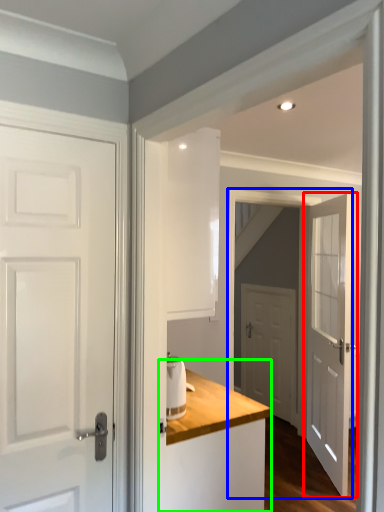
Question: Which object is the closest to the door (highlighted by a red box)? Choose among these: screen door (highlighted by a blue box) or dresser (highlighted by a green box).

Choices:
 (A) screen door
 (B) dresser

Answer: (A)